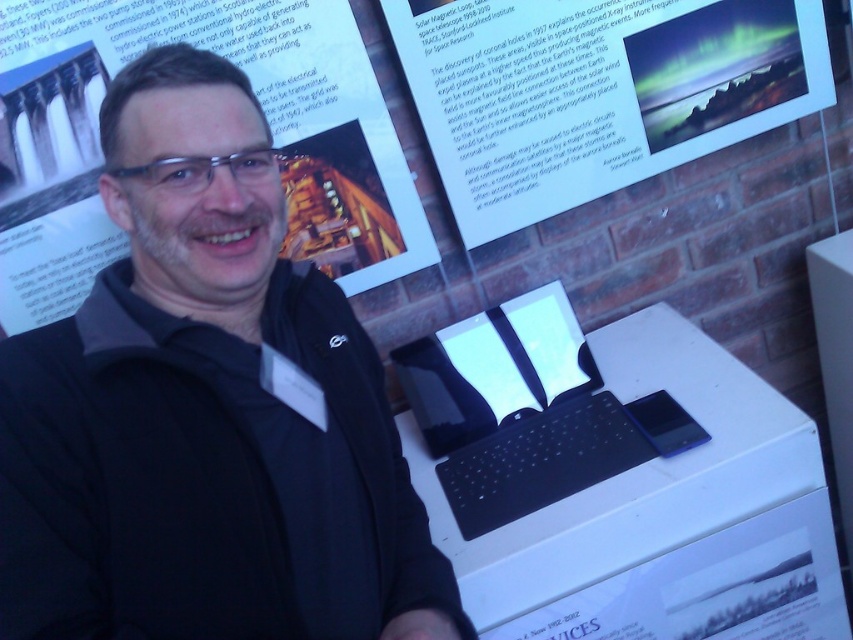
You are a photographer taking a picture of the scene described. You notice the black matte jacket at center and the black glossy laptop at center. Which object is taller in the image?

The black matte jacket at center is much taller than the black glossy laptop at center according to the description.

You are a photographer trying to capture the man in the image. The camera you are using has a sensor that can only focus on objects within a 0.2 to 0.3 range on the x and y axes. Given the coordinates of the black matte jacket at center at point 0.642, 0.243, will the camera be able to focus on the jacket?

The coordinates of the black matte jacket at center are at point (206,410). Since the camera can only focus on objects within a 0.2 to 0.3 range on both axes, the jacket is outside this range and cannot be focused properly.

You are at the point labeled point (x=793, y=3) and want to walk to the point labeled point (x=305, y=237). Which direction should you move?

You should move forward because point (x=305, y=237) is in front of point (x=793, y=3).